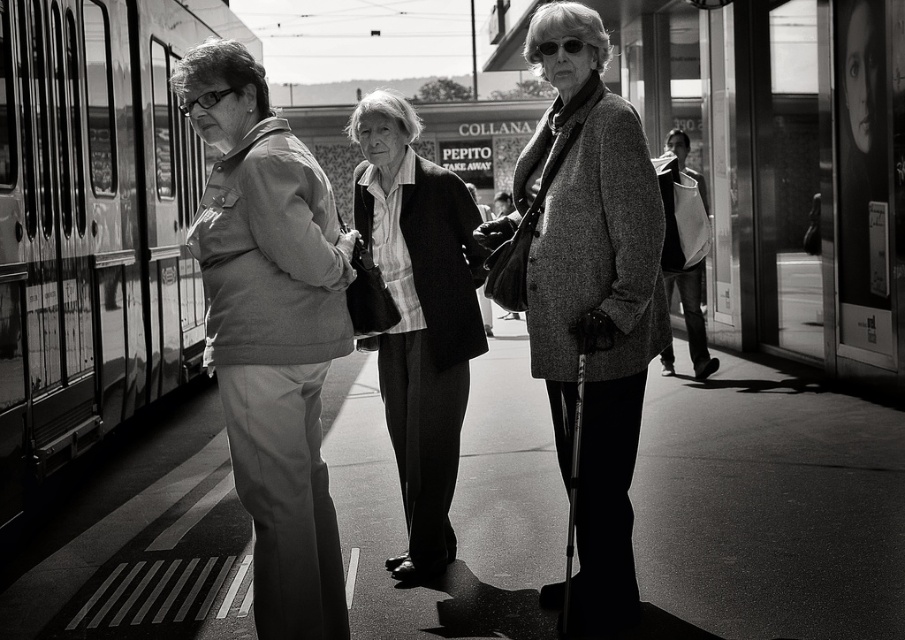
In the train station scene, there is a metallic train at left and a matte gray jacket at left. Which object is positioned further to the left?

The metallic train at left is positioned further to the left than the matte gray jacket at left.

You are an observer at the train station platform. You notice two items of clothing in the scene. The first is the matte gray sweater at center, and the second is the matte gray jacket at left. Which of these two items is covering part of the other?

The matte gray sweater at center is positioned over the matte gray jacket at left, so it is covering part of it.

You are a tailor observing the two coats on the mannequin in the center of the image. The coats are the textured gray coat at center and the smooth black blazer at center. Which one has a greater height?

The textured gray coat at center is taller than the smooth black blazer at center.